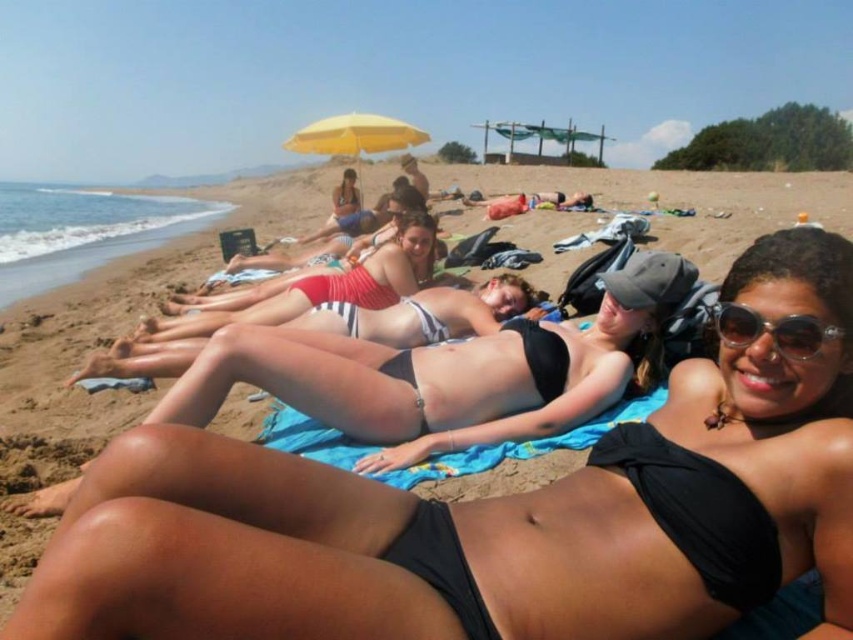
Question: Which object appears closest to the camera in this image?

Choices:
 (A) black matte bikini at center
 (B) sunglasses at center

Answer: (A)

Question: Observing the image, what is the correct spatial positioning of black matte bikini at center in reference to yellow fabric umbrella at upper center?

Choices:
 (A) below
 (B) above

Answer: (A)

Question: Is yellow fabric umbrella at upper center positioned at the back of sunglasses at center?

Choices:
 (A) no
 (B) yes

Answer: (B)

Question: Which object appears farthest from the camera in this image?

Choices:
 (A) black matte bikini top at lower center
 (B) black bikini at center
 (C) yellow fabric umbrella at upper center

Answer: (C)

Question: Considering the relative positions of black bikini at center and sunglasses at center in the image provided, where is black bikini at center located with respect to sunglasses at center?

Choices:
 (A) right
 (B) left

Answer: (B)

Question: Which object is closer to the camera taking this photo?

Choices:
 (A) black matte bikini top at lower center
 (B) black bikini at center
 (C) yellow fabric umbrella at upper center

Answer: (A)